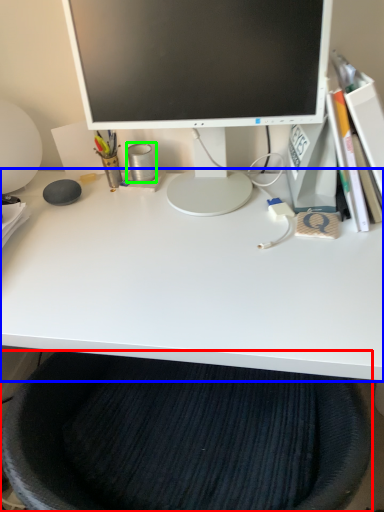
Question: Estimate the real-world distances between objects in this image. Which object is closer to computer chair (highlighted by a red box), desk (highlighted by a blue box) or stationery (highlighted by a green box)?

Choices:
 (A) desk
 (B) stationery

Answer: (A)